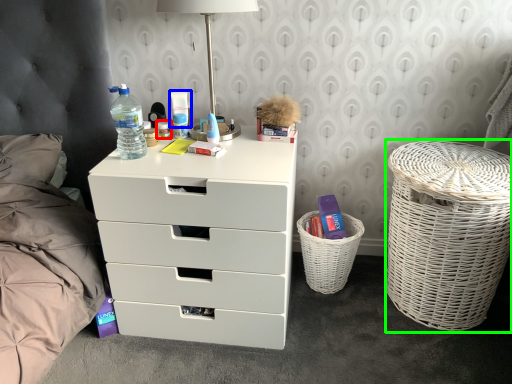
Question: Based on their relative distances, which object is farther from toiletry (highlighted by a red box)? Choose from toiletry (highlighted by a blue box) and laundry basket (highlighted by a green box).

Choices:
 (A) toiletry
 (B) laundry basket

Answer: (B)